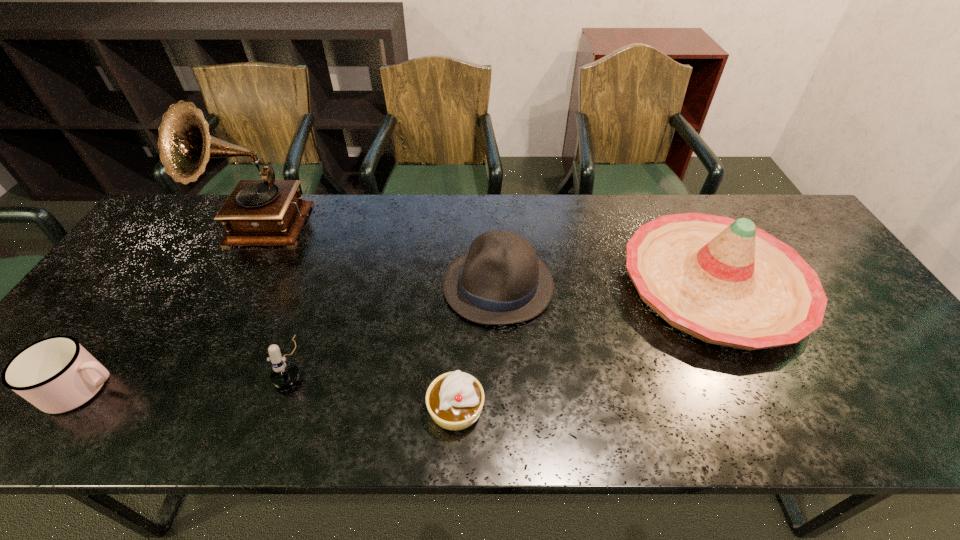
Image resolution: width=960 pixels, height=540 pixels. Find the location of `object that is at the right edge`. object that is at the right edge is located at coordinates (724, 281).

Identify the location of object positioned at the near left corner. Image resolution: width=960 pixels, height=540 pixels. (56, 374).

The height and width of the screenshot is (540, 960). Find the location of `object that is positioned at the far right corner`. object that is positioned at the far right corner is located at coordinates (724, 281).

Find the location of `free space at the far edge of the desktop`. free space at the far edge of the desktop is located at coordinates (382, 217).

In the image, there is a desktop. In order to click on vacant region at the near edge in this screenshot , I will do `click(618, 423)`.

Image resolution: width=960 pixels, height=540 pixels. In the image, there is a desktop. Find the location of `free space at the left edge`. free space at the left edge is located at coordinates (89, 327).

I want to click on free space at the right edge, so click(890, 388).

In the image, there is a desktop. Identify the location of free space at the far left corner. (x=202, y=195).

The height and width of the screenshot is (540, 960). I want to click on free space between the shortest object and the microphone, so click(x=374, y=385).

Identify the location of vacant space that's between the mug and the rightmost object. (398, 337).